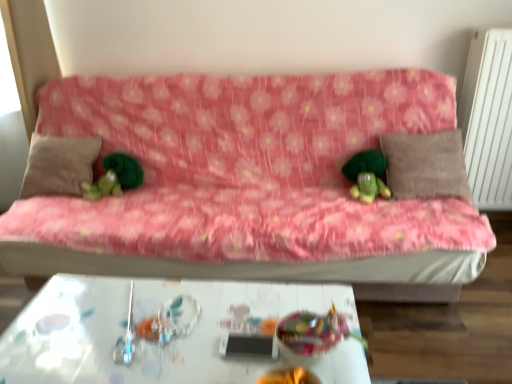
Question: Is translucent plastic bowl at center, arranged as the 2th toy when viewed from the top, inside the boundaries of white textured radiator at right, or outside?

Choices:
 (A) outside
 (B) inside

Answer: (A)

Question: Considering their positions, is translucent plastic bowl at center, the 1th toy when ordered from right to left, located in front of or behind white textured radiator at right?

Choices:
 (A) front
 (B) behind

Answer: (A)

Question: Considering the real-world distances, which object is closest to the green plush toy at left, placed as the 2th toy when sorted from front to back?

Choices:
 (A) white textured radiator at right
 (B) beige fabric pillow at left, the second pillow viewed from the right
 (C) green plush toy at center
 (D) pink fabric couch at center
 (E) translucent plastic bowl at center, positioned as the 2th toy in left-to-right order

Answer: (B)

Question: Which object is the closest to the green plush toy at left, which is the first toy in left-to-right order?

Choices:
 (A) green plush toy at center
 (B) white glossy table at center
 (C) white textured radiator at right
 (D) translucent plastic bowl at center, arranged as the 2th toy when viewed from the top
 (E) brown fabric pillow at right, placed as the 1th pillow when sorted from right to left

Answer: (B)